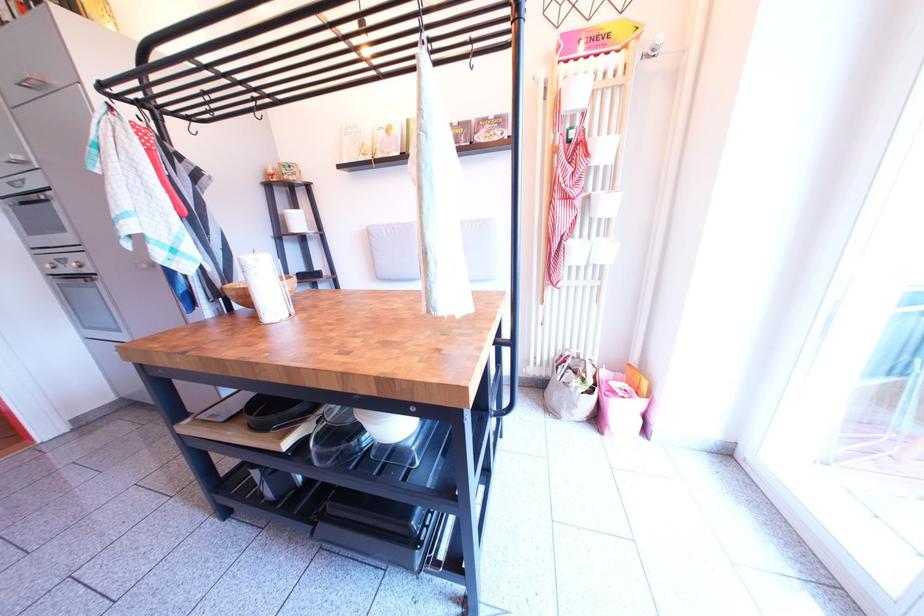
The height and width of the screenshot is (616, 924). In order to click on black pot in this screenshot , I will do `click(275, 411)`.